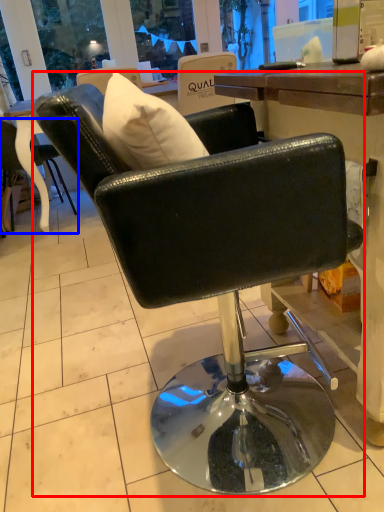
Question: Which of the following is the farthest to the observer, chair (highlighted by a red box) or chair (highlighted by a blue box)?

Choices:
 (A) chair
 (B) chair

Answer: (B)